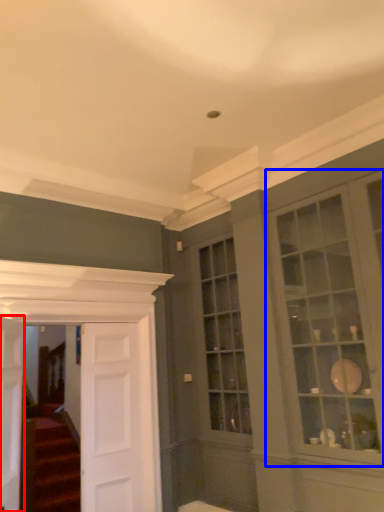
Question: Which object appears farthest to the camera in this image, door (highlighted by a red box) or window (highlighted by a blue box)?

Choices:
 (A) door
 (B) window

Answer: (A)